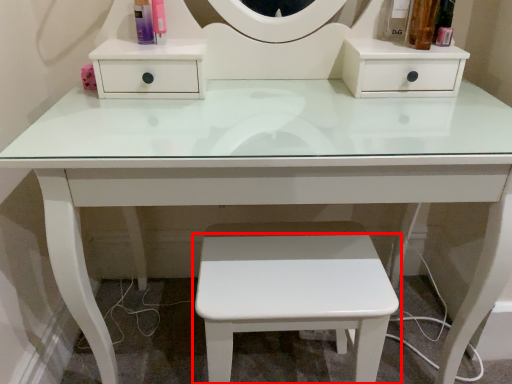
Question: From the image's perspective, what is the correct spatial positioning of stool (annotated by the red box) in reference to toiletry?

Choices:
 (A) above
 (B) below

Answer: (B)